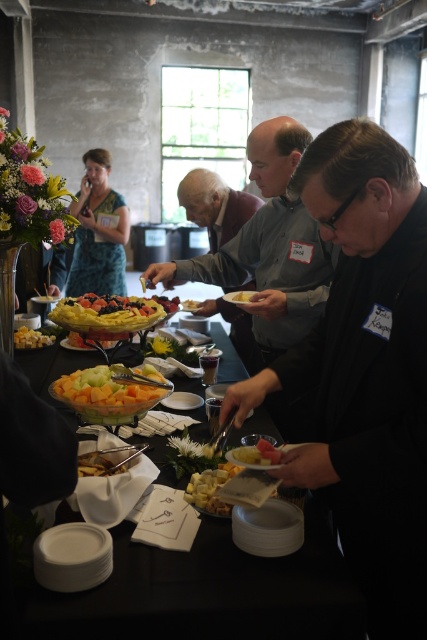
Question: Is translucent plastic tray at center below maroon sweater at center?

Choices:
 (A) yes
 (B) no

Answer: (A)

Question: Can you confirm if gray fabric shirt at center is positioned to the left of yellow matte cheese at center?

Choices:
 (A) no
 (B) yes

Answer: (A)

Question: Is yellow matte fruit at center below matte white bowl at center?

Choices:
 (A) no
 (B) yes

Answer: (B)

Question: Which point is closer to the camera taking this photo?

Choices:
 (A) (81, 468)
 (B) (271, 449)
 (C) (234, 468)

Answer: (B)

Question: Estimate the real-world distances between objects in this image. Which object is closer to the matte white bowl at center?

Choices:
 (A) black glossy grapes at center
 (B) yellow matte fruit at center
 (C) translucent glass bowl at center

Answer: (C)

Question: Which point is farther from the camera taking this photo?

Choices:
 (A) (177, 300)
 (B) (263, 595)
 (C) (210, 477)
 (D) (351, 129)

Answer: (A)